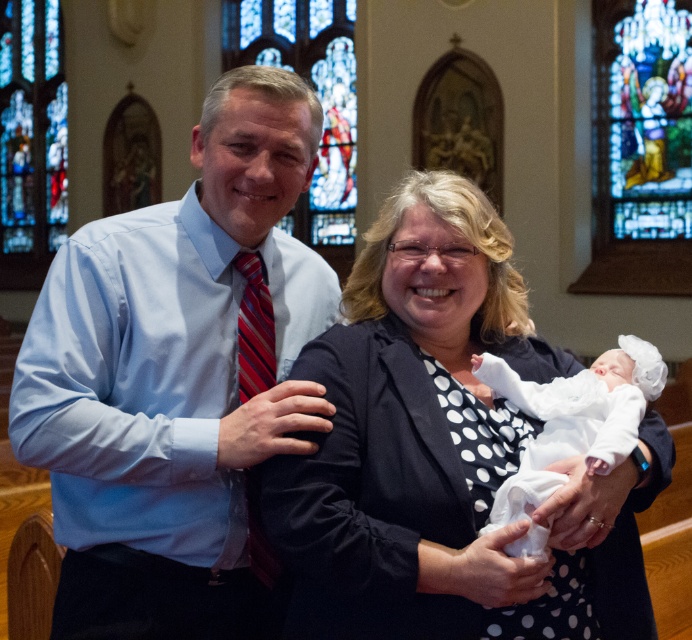
You are a photographer inside a church and want to capture a photo of the stained glass windows. The stained glass window at upper center and the stained glass window at upper left are both in your view. Which stained glass window is located lower in the image?

The stained glass window at upper center is positioned under the stained glass window at upper left, so it is located lower in the image.

You are a photographer taking a picture of the stained glass window at upper center and the matte blue shirt at center. Which object is positioned to the left of the other?

The matte blue shirt at center is positioned to the left of the stained glass window at upper center.